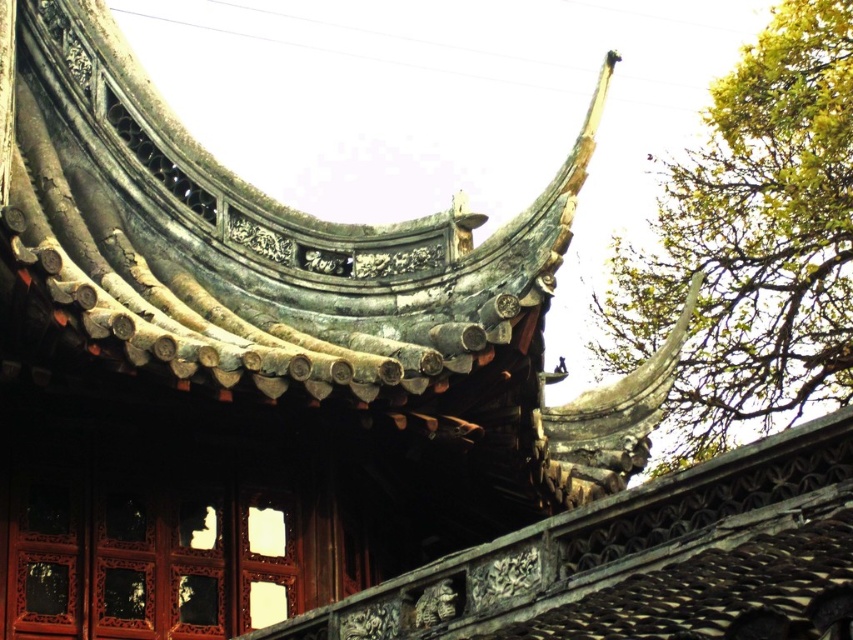
Question: Can you confirm if greenish-gray stone roof at upper center is smaller than green leafy tree at upper right?

Choices:
 (A) no
 (B) yes

Answer: (B)

Question: Does greenish-gray stone roof at upper center appear under green leafy tree at upper right?

Choices:
 (A) yes
 (B) no

Answer: (A)

Question: Which point is closer to the camera?

Choices:
 (A) (32, 170)
 (B) (635, 278)

Answer: (A)

Question: Which point is closer to the camera?

Choices:
 (A) (769, 54)
 (B) (354, 305)

Answer: (B)

Question: Is greenish-gray stone roof at upper center further to camera compared to green leafy tree at upper right?

Choices:
 (A) no
 (B) yes

Answer: (A)